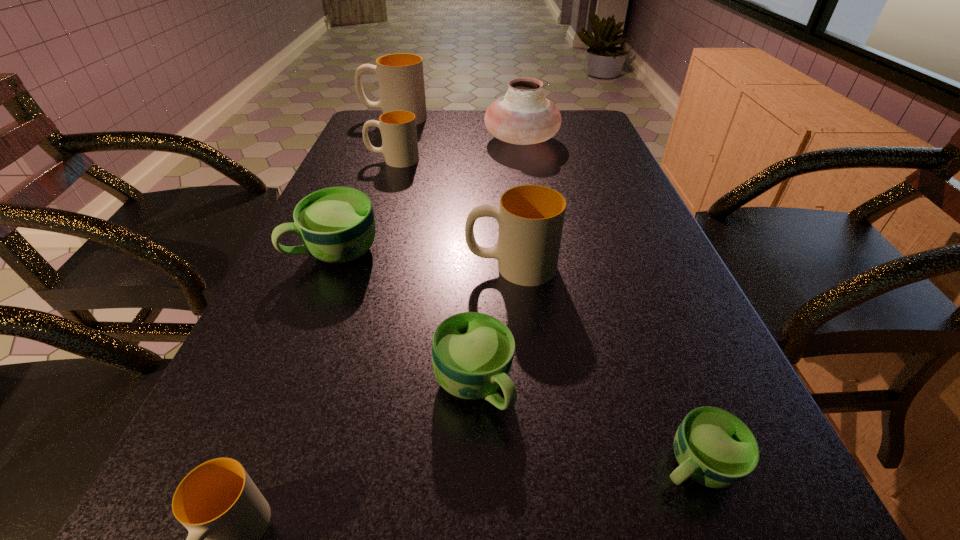
This screenshot has width=960, height=540. I want to click on the closest yellow cup to the fifth farthest cup, so click(530, 217).

Locate which blue cup is the closest to the third smallest yellow cup. Please provide its 2D coordinates. Your answer should be formatted as a tuple, i.e. [(x, y)], where the tuple contains the x and y coordinates of a point satisfying the conditions above.

[(472, 353)]

Select which blue cup appears as the closest to the smallest yellow cup. Please provide its 2D coordinates. Your answer should be formatted as a tuple, i.e. [(x, y)], where the tuple contains the x and y coordinates of a point satisfying the conditions above.

[(472, 353)]

In order to click on free space that satisfies the following two spatial constraints: 1. with the handle on the side of the pottery; 2. on the left side of the second biggest yellow cup in this screenshot , I will do `click(501, 141)`.

The height and width of the screenshot is (540, 960). In order to click on free space that satisfies the following two spatial constraints: 1. with the handle on the side of the third biggest yellow cup; 2. on the left side of the pottery in this screenshot , I will do `click(399, 141)`.

Identify the location of vacant space that satisfies the following two spatial constraints: 1. on the front side of the leftmost blue cup; 2. on the right side of the nearest blue cup. This screenshot has height=540, width=960. (251, 464).